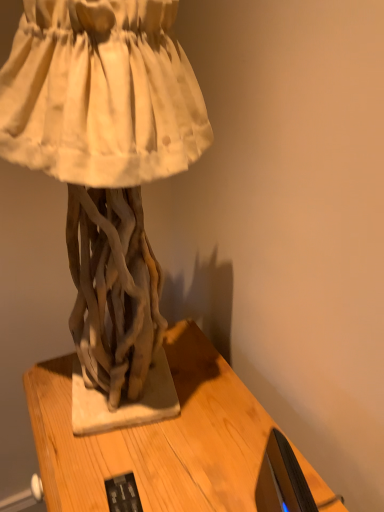
Question: From the image's perspective, is matte driftwood sculpture at center beneath wooden table at center?

Choices:
 (A) yes
 (B) no

Answer: (B)

Question: Is matte driftwood sculpture at center taller than wooden table at center?

Choices:
 (A) yes
 (B) no

Answer: (B)

Question: Is matte driftwood sculpture at center aimed at wooden table at center?

Choices:
 (A) no
 (B) yes

Answer: (A)

Question: From a real-world perspective, is matte driftwood sculpture at center over wooden table at center?

Choices:
 (A) yes
 (B) no

Answer: (A)

Question: Is matte driftwood sculpture at center shorter than wooden table at center?

Choices:
 (A) yes
 (B) no

Answer: (A)

Question: Choose the correct answer: Is black glossy monitor at lower right inside wooden table at center or outside it?

Choices:
 (A) inside
 (B) outside

Answer: (B)

Question: In terms of size, does black glossy monitor at lower right appear bigger or smaller than wooden table at center?

Choices:
 (A) big
 (B) small

Answer: (B)

Question: Is black glossy monitor at lower right taller or shorter than wooden table at center?

Choices:
 (A) tall
 (B) short

Answer: (B)

Question: Considering their positions, is black glossy monitor at lower right located in front of or behind wooden table at center?

Choices:
 (A) behind
 (B) front

Answer: (B)

Question: Choose the correct answer: Is black glossy monitor at lower right inside matte driftwood sculpture at center or outside it?

Choices:
 (A) inside
 (B) outside

Answer: (B)

Question: From a real-world perspective, is black glossy monitor at lower right above or below matte driftwood sculpture at center?

Choices:
 (A) above
 (B) below

Answer: (B)

Question: From the image's perspective, relative to matte driftwood sculpture at center, is black glossy monitor at lower right above or below?

Choices:
 (A) below
 (B) above

Answer: (A)

Question: Is black glossy monitor at lower right in front of or behind matte driftwood sculpture at center in the image?

Choices:
 (A) behind
 (B) front

Answer: (A)

Question: From a real-world perspective, relative to matte driftwood sculpture at center, is wooden table at center vertically above or below?

Choices:
 (A) above
 (B) below

Answer: (B)

Question: From the image's perspective, is wooden table at center above or below matte driftwood sculpture at center?

Choices:
 (A) below
 (B) above

Answer: (A)